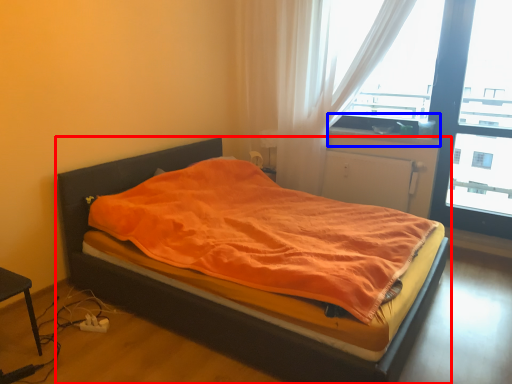
Question: Which object appears closest to the camera in this image, bed (highlighted by a red box) or window sill (highlighted by a blue box)?

Choices:
 (A) bed
 (B) window sill

Answer: (A)